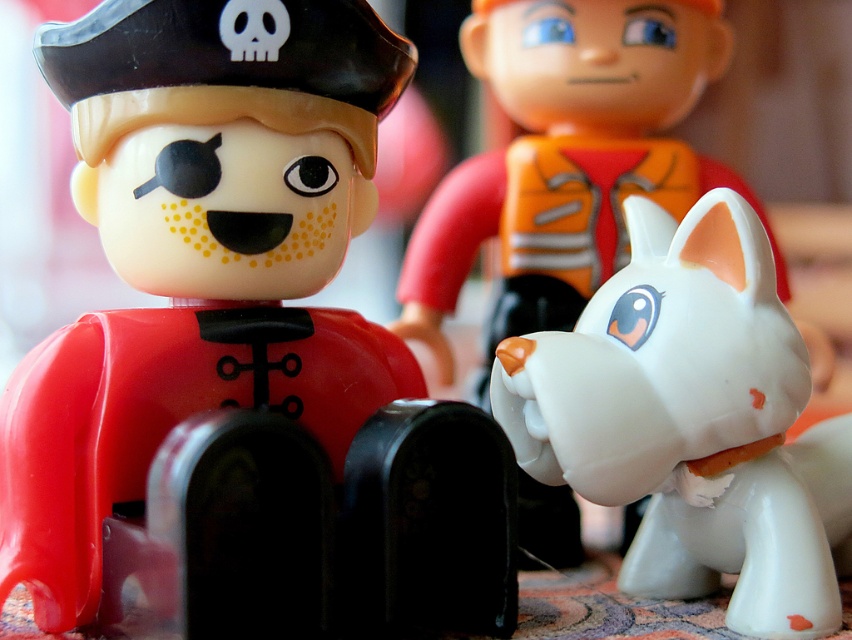
Between matte black pirate hat at upper left and white glossy dog at center, which one is positioned higher?

Positioned higher is matte black pirate hat at upper left.

Does point (275, 410) lie in front of point (769, 534)?

Yes, point (275, 410) is closer to viewer.

Is point (116, 180) more distant than point (684, 525)?

That is False.

Image resolution: width=852 pixels, height=640 pixels. Find the location of `matte black pirate hat at upper left`. matte black pirate hat at upper left is located at coordinates (240, 349).

Can you confirm if white glossy dog at center is shorter than white matte dog at center?

Yes.

Can you confirm if white glossy dog at center is thinner than white matte dog at center?

Indeed, white glossy dog at center has a lesser width compared to white matte dog at center.

Describe the element at coordinates (692, 420) in the screenshot. I see `white glossy dog at center` at that location.

Locate an element on the screen. This screenshot has width=852, height=640. white glossy dog at center is located at coordinates (692, 420).

Between matte black pirate hat at upper left and white matte dog at center, which one has less height?

Standing shorter between the two is matte black pirate hat at upper left.

Looking at this image, does matte black pirate hat at upper left have a smaller size compared to white matte dog at center?

Yes.

Between point (255, 628) and point (482, 154), which one is positioned behind?

The point (482, 154) is behind.

You are a GUI agent. You are given a task and a screenshot of the screen. Output one action in this format:
    pyautogui.click(x=<x>, y=<y>)
    Task: Click on the matte black pirate hat at upper left
    The image size is (852, 640).
    Given the screenshot: What is the action you would take?
    pyautogui.click(x=240, y=349)